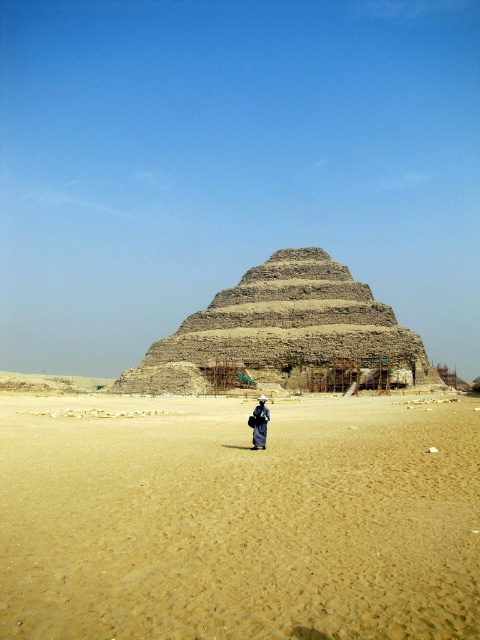
Question: Which point is farther to the camera?

Choices:
 (A) light brown stone steps at center
 (B) brown sandy desert at center
 (C) dark blue fabric at center

Answer: (A)

Question: Which object is the farthest from the light brown stone steps at center?

Choices:
 (A) dark blue fabric at center
 (B) brown sandy desert at center

Answer: (B)

Question: Is brown sandy desert at center further to camera compared to light brown stone steps at center?

Choices:
 (A) yes
 (B) no

Answer: (B)

Question: Can you confirm if brown sandy desert at center is positioned above dark blue fabric at center?

Choices:
 (A) no
 (B) yes

Answer: (A)

Question: Is brown sandy desert at center thinner than dark blue fabric at center?

Choices:
 (A) yes
 (B) no

Answer: (B)

Question: Which point is closer to the camera taking this photo?

Choices:
 (A) (356, 352)
 (B) (255, 429)

Answer: (B)